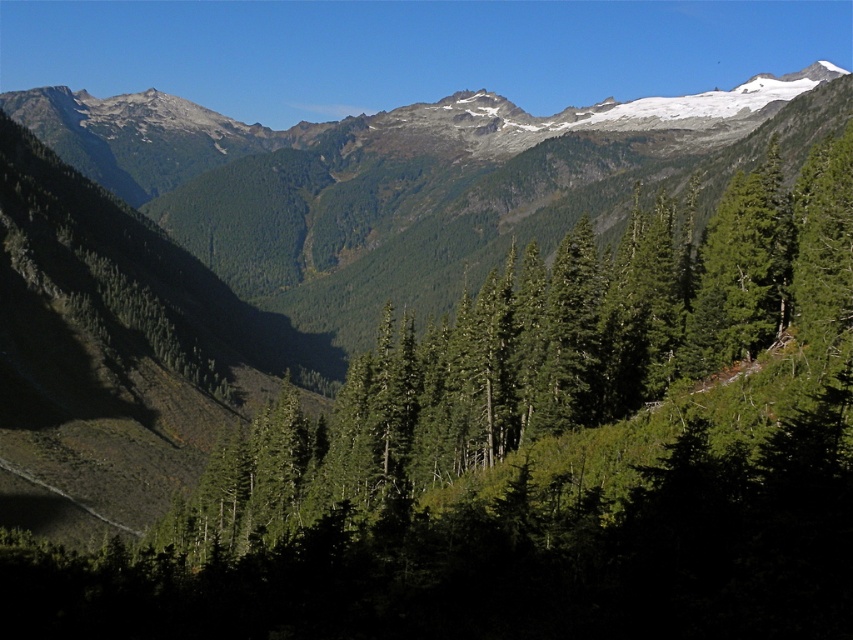
Consider the image. You are a hiker standing at the base of the green textured mountains at upper center and want to reach the green textured tree at center. Which direction should you move to get closer to the tree?

The green textured tree at center is in front of the green textured mountains at upper center, so you should move forward towards the tree to get closer.

Looking at the mountainous landscape, which object is positioned to the left of the other between the green textured tree at center and the green textured mountains at upper center?

The green textured mountains at upper center are positioned to the left of the green textured tree at center.